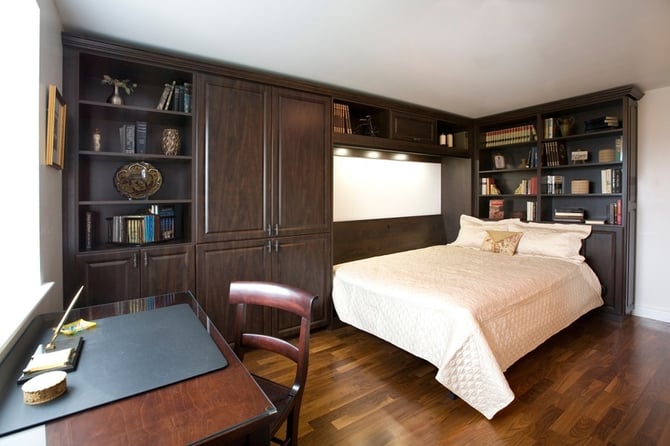
Find where someone would stand to get into bed in the image. Your answer should be formatted as a list of tuples, i.e. [(x1, y1), (x2, y2), ...], where each tuple contains the x and y coordinates of a point satisfying the conditions above.

[(561, 350)]